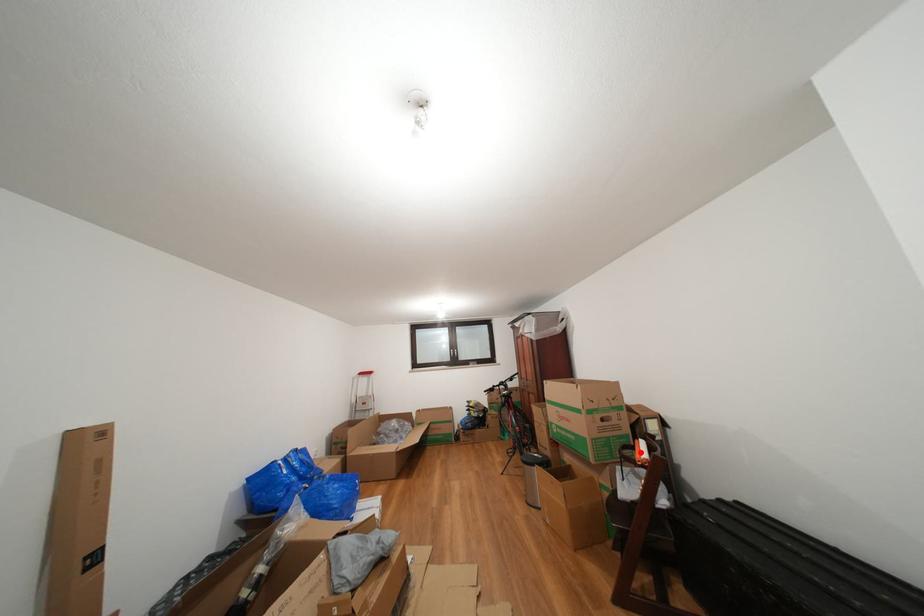
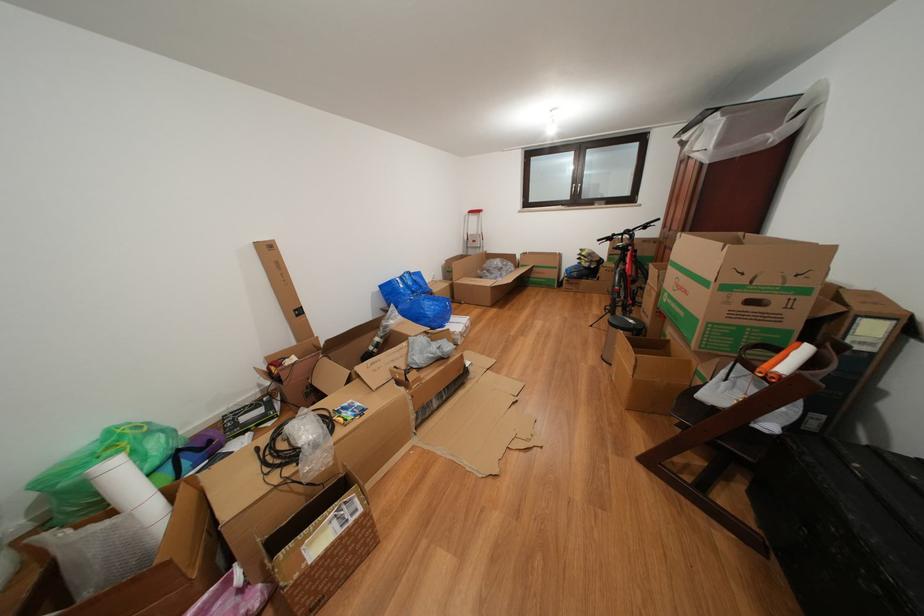
Locate, in the second image, the point that corresponds to the highlighted location in the first image.

(784, 355)